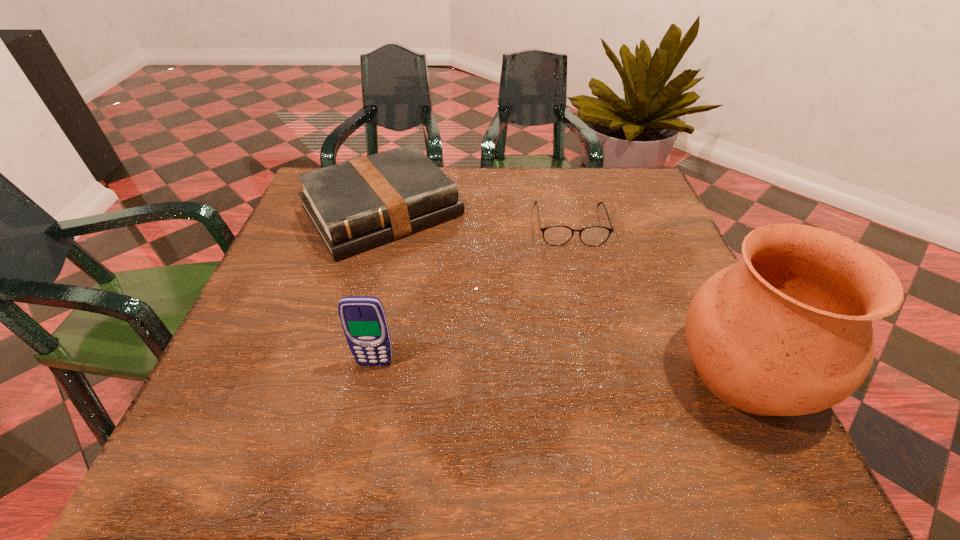
The image size is (960, 540). I want to click on blank space that satisfies the following two spatial constraints: 1. on the front-facing side of the cellular telephone; 2. on the right side of the pottery, so click(x=373, y=372).

Where is `free space that satisfies the following two spatial constraints: 1. on the front side of the tallest object; 2. on the right side of the spectacles`? This screenshot has width=960, height=540. free space that satisfies the following two spatial constraints: 1. on the front side of the tallest object; 2. on the right side of the spectacles is located at coordinates (605, 372).

Locate an element on the screen. vacant space that satisfies the following two spatial constraints: 1. on the front side of the hardback book; 2. on the left side of the rightmost object is located at coordinates (338, 372).